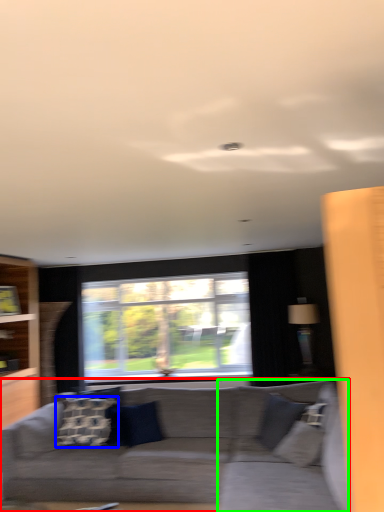
Question: Which is farther away from studio couch (highlighted by a red box)? pillow (highlighted by a blue box) or swivel chair (highlighted by a green box)?

Choices:
 (A) pillow
 (B) swivel chair

Answer: (A)